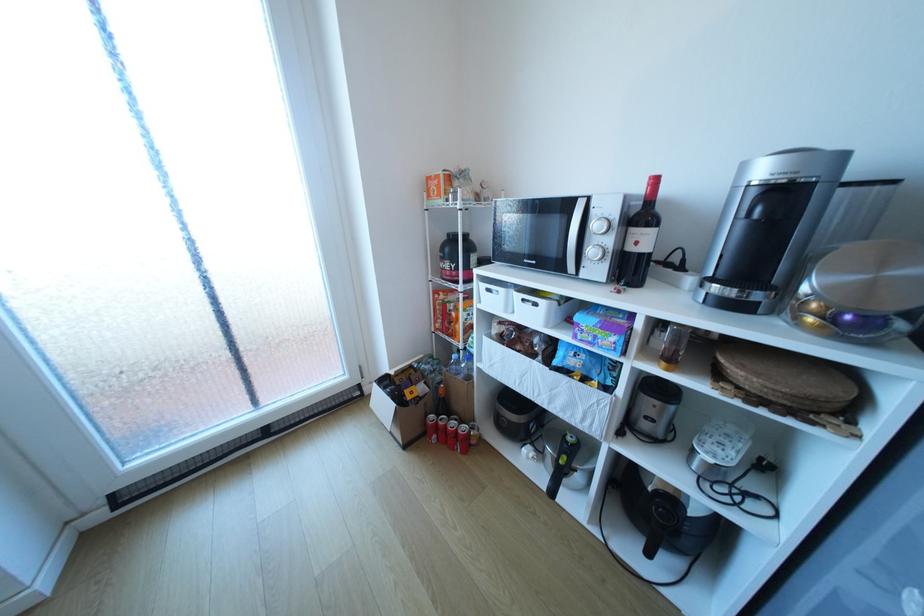
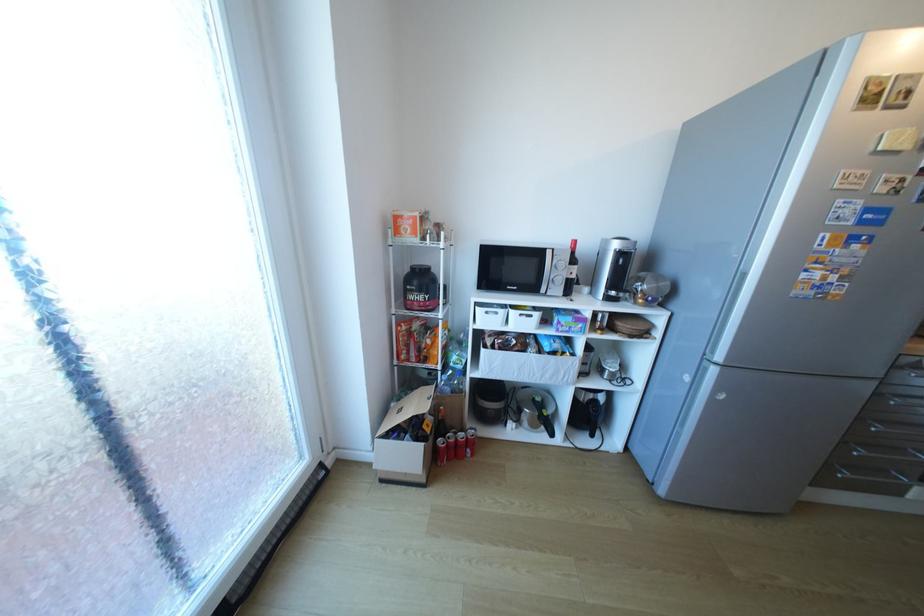
Find the pixel in the second image that matches (445,422) in the first image.

(456, 442)